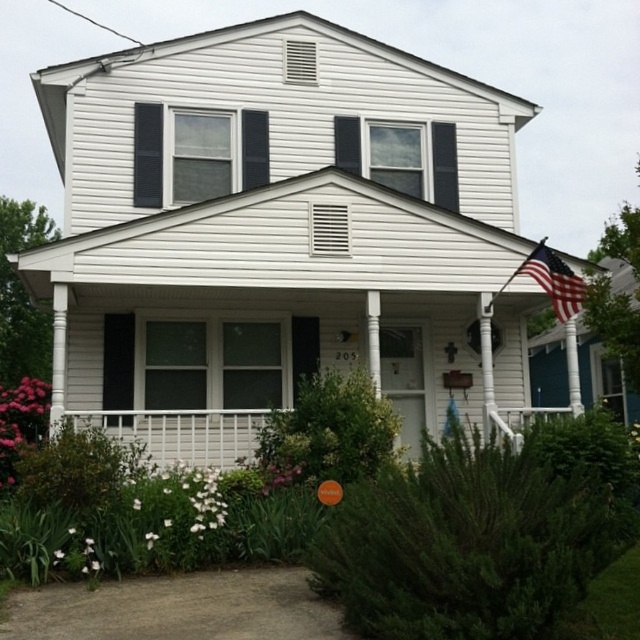
You are standing in front of the house and notice two flowers in the garden. Which one is positioned to the left of the other? The flowers are the pink matte flower at lower left and the white matte flower at center.

The pink matte flower at lower left is positioned to the left of the white matte flower at center.

You are standing in front of the house and want to find the pink matte flower at lower left. Based on the coordinates given, where should you look relative to the house?

The pink matte flower at lower left is located at point (20, 420), which means it is positioned to the lower left of the house.

You are standing in front of the house and want to place a new flower pot. You see a point marked at coordinates point (554, 280). Where is this point located relative to the american flag at upper right?

The point (554, 280) indicates the location of the american flag at upper right.